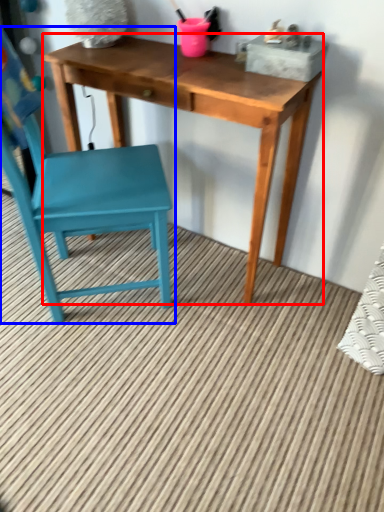
Question: Which object appears farthest to the camera in this image, table (highlighted by a red box) or chair (highlighted by a blue box)?

Choices:
 (A) table
 (B) chair

Answer: (A)